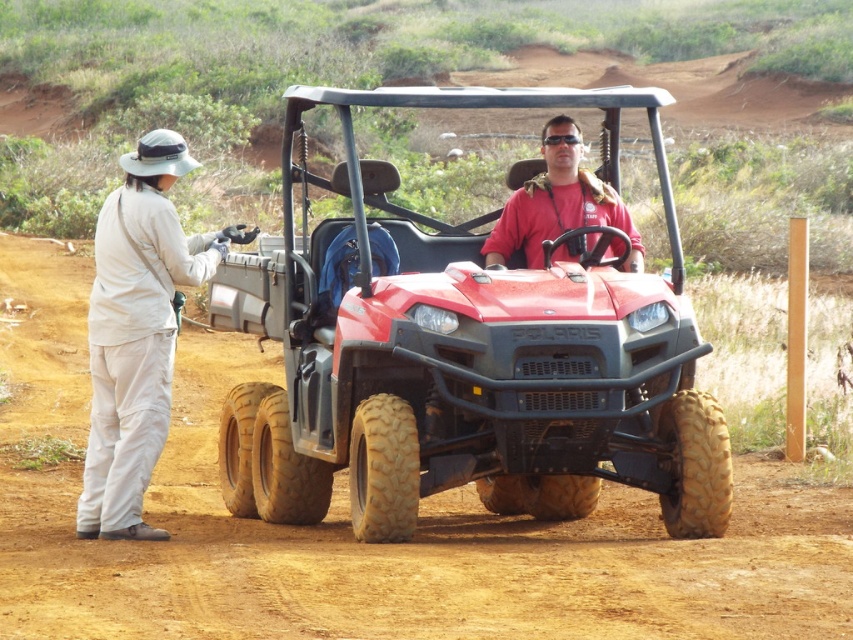
Question: Does red matte/soft polaris at center have a smaller size compared to matte red shirt at center?

Choices:
 (A) no
 (B) yes

Answer: (A)

Question: Which object is positioned closest to the light beige fabric hat at left?

Choices:
 (A) red matte/soft polaris at center
 (B) matte red shirt at center

Answer: (A)

Question: Where is light beige fabric hat at left located in relation to matte red shirt at center in the image?

Choices:
 (A) below
 (B) above

Answer: (A)

Question: Which is farther from the light beige fabric hat at left?

Choices:
 (A) red matte/soft polaris at center
 (B) matte red shirt at center

Answer: (B)

Question: Does red matte/soft polaris at center come in front of light beige fabric hat at left?

Choices:
 (A) no
 (B) yes

Answer: (B)

Question: Which point is closer to the camera?

Choices:
 (A) red matte/soft polaris at center
 (B) light beige fabric hat at left
 (C) matte red shirt at center

Answer: (A)